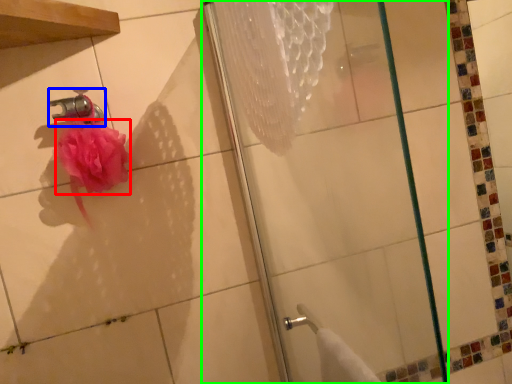
Question: Which object is the closest to the flower (highlighted by a red box)? Choose among these: faucet (highlighted by a blue box) or shower (highlighted by a green box).

Choices:
 (A) faucet
 (B) shower

Answer: (A)